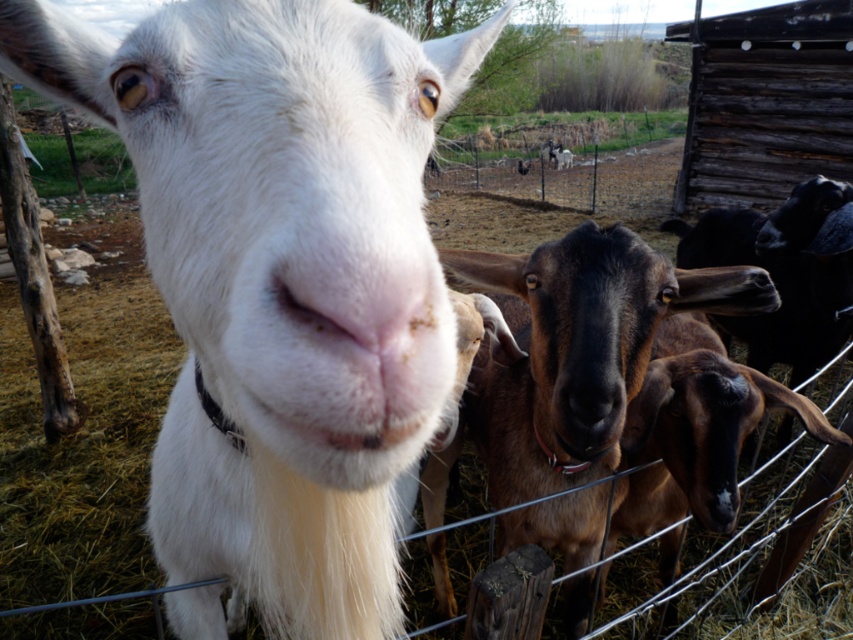
Question: Among these objects, which one is farthest from the camera?

Choices:
 (A) brown furry goat at center
 (B) white woolen goat at center

Answer: (A)

Question: Among these objects, which one is farthest from the camera?

Choices:
 (A) brown furry goat at center
 (B) white woolen goat at center

Answer: (A)

Question: Does white woolen goat at center have a larger size compared to brown furry goat at center?

Choices:
 (A) yes
 (B) no

Answer: (A)

Question: Can you confirm if white woolen goat at center is positioned below brown furry goat at center?

Choices:
 (A) yes
 (B) no

Answer: (A)

Question: Can you confirm if white woolen goat at center is smaller than brown furry goat at center?

Choices:
 (A) yes
 (B) no

Answer: (B)